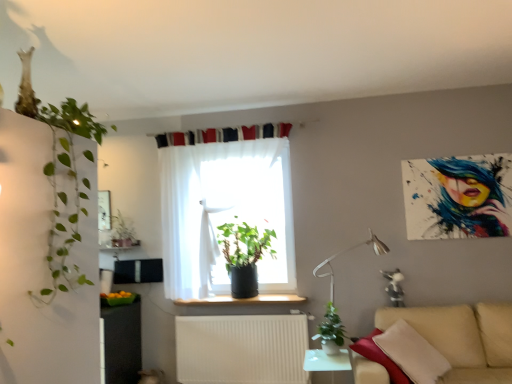
What do you see at coordinates (241, 349) in the screenshot?
I see `white matte radiator at lower center` at bounding box center [241, 349].

What are the coordinates of `green matte plant at upper left, which is the fourth houseplant in right-to-left order` in the screenshot? It's located at (122, 233).

What is the approximate height of green matte plant at lower center, which is the third houseplant in back-to-front order?

It is 14.74 inches.

Identify the location of green matte plant at lower center, which appears as the 2th houseplant when viewed from the front. This screenshot has width=512, height=384. (331, 331).

Where is `green leafy plant at left, which is counted as the 2th houseplant, starting from the left`? green leafy plant at left, which is counted as the 2th houseplant, starting from the left is located at coordinates (57, 182).

Measure the distance between beige fabric couch at lower right and camera.

beige fabric couch at lower right is 3.04 meters from camera.

This screenshot has height=384, width=512. I want to click on white matte radiator at lower center, so click(x=241, y=349).

Consider the image. How far apart are green leafy plant at left, acting as the third houseplant starting from the right, and white glossy table at lower center?

They are 7.13 feet apart.

From their relative heights in the image, would you say green leafy plant at left, acting as the third houseplant starting from the right, is taller or shorter than white glossy table at lower center?

In the image, green leafy plant at left, acting as the third houseplant starting from the right, appears to be taller than white glossy table at lower center.

From the image's perspective, between green leafy plant at left, the 4th houseplant viewed from the back, and white glossy table at lower center, which one is located above?

green leafy plant at left, the 4th houseplant viewed from the back.

In order to click on the 2nd houseplant to the left of the white glossy table at lower center, starting your count from the anchor in this screenshot , I will do `click(57, 182)`.

Is green matte plant at lower center, the 4th houseplant positioned from the left, in front of or behind white matte radiator at lower center in the image?

Clearly, green matte plant at lower center, the 4th houseplant positioned from the left, is in front of white matte radiator at lower center.

From a real-world perspective, is green matte plant at lower center, the 1th houseplant in the right-to-left sequence, positioned under white matte radiator at lower center based on gravity?

Incorrect, from a real-world perspective, green matte plant at lower center, the 1th houseplant in the right-to-left sequence, is higher than white matte radiator at lower center.

Is point (313, 338) less distant than point (298, 342)?

Yes.

Considering the relative sizes of green matte plant at lower center, which is the third houseplant in back-to-front order, and white matte radiator at lower center in the image provided, is green matte plant at lower center, which is the third houseplant in back-to-front order, smaller than white matte radiator at lower center?

Yes, green matte plant at lower center, which is the third houseplant in back-to-front order, is smaller than white matte radiator at lower center.

Who is bigger, green matte plant at upper left, which appears as the fourth houseplant when viewed from the front, or metallic silver table lamp at lower right?

metallic silver table lamp at lower right.

Are green matte plant at upper left, which appears as the fourth houseplant when viewed from the front, and metallic silver table lamp at lower right far apart?

Yes, green matte plant at upper left, which appears as the fourth houseplant when viewed from the front, and metallic silver table lamp at lower right are quite far apart.

From a real-world perspective, is green matte plant at upper left, which is the fourth houseplant in right-to-left order, positioned above or below metallic silver table lamp at lower right?

green matte plant at upper left, which is the fourth houseplant in right-to-left order, is situated higher than metallic silver table lamp at lower right in the real world.

Can you confirm if white matte radiator at lower center is wider than green matte plant at lower center, the 1th houseplant in the right-to-left sequence?

No.

Considering the relative positions of white matte radiator at lower center and green matte plant at lower center, which is the third houseplant in back-to-front order, in the image provided, is white matte radiator at lower center in front of green matte plant at lower center, which is the third houseplant in back-to-front order,?

No, white matte radiator at lower center is further to the viewer.

Visually, is white matte radiator at lower center positioned to the left or to the right of green matte plant at lower center, which is the third houseplant in back-to-front order?

white matte radiator at lower center is to the left of green matte plant at lower center, which is the third houseplant in back-to-front order.

Measure the distance between white matte radiator at lower center and green matte plant at lower center, which is the third houseplant in back-to-front order.

white matte radiator at lower center is 30.46 inches from green matte plant at lower center, which is the third houseplant in back-to-front order.

In terms of width, does green matte plant at lower center, the 1th houseplant in the right-to-left sequence, look wider or thinner when compared to black plastic window sill at center?

In the image, green matte plant at lower center, the 1th houseplant in the right-to-left sequence, appears to be more narrow than black plastic window sill at center.

From the image's perspective, is green matte plant at lower center, which is the third houseplant in back-to-front order, positioned above or below black plastic window sill at center?

Based on their image positions, green matte plant at lower center, which is the third houseplant in back-to-front order, is located beneath black plastic window sill at center.

From a real-world perspective, is green matte plant at lower center, the 4th houseplant positioned from the left, physically located above or below black plastic window sill at center?

In terms of real-world spatial position, green matte plant at lower center, the 4th houseplant positioned from the left, is below black plastic window sill at center.

Considering the relative sizes of green matte plant at center, arranged as the 3th houseplant when viewed from the front, and white glossy table at lower center in the image provided, is green matte plant at center, arranged as the 3th houseplant when viewed from the front, shorter than white glossy table at lower center?

Incorrect, the height of green matte plant at center, arranged as the 3th houseplant when viewed from the front, does not fall short of that of white glossy table at lower center.

Is green matte plant at center, which ranks as the 3th houseplant in left-to-right order, far from white glossy table at lower center?

Yes, green matte plant at center, which ranks as the 3th houseplant in left-to-right order, and white glossy table at lower center are located far from each other.

Is green matte plant at center, placed as the second houseplant when sorted from back to front, at the left side of white glossy table at lower center?

Yes.

Does green matte plant at center, which ranks as the 3th houseplant in left-to-right order, have a smaller size compared to white glossy table at lower center?

No, green matte plant at center, which ranks as the 3th houseplant in left-to-right order, is not smaller than white glossy table at lower center.

Is metallic silver table lamp at lower right oriented towards green matte plant at center, which ranks as the 3th houseplant in left-to-right order?

No, metallic silver table lamp at lower right is not facing towards green matte plant at center, which ranks as the 3th houseplant in left-to-right order.

In the scene shown: How many degrees apart are the facing directions of metallic silver table lamp at lower right and green matte plant at center, which ranks as the 3th houseplant in left-to-right order?

0.989 degrees.

Considering the relative sizes of metallic silver table lamp at lower right and green matte plant at center, arranged as the 3th houseplant when viewed from the front, in the image provided, is metallic silver table lamp at lower right bigger than green matte plant at center, arranged as the 3th houseplant when viewed from the front,?

Correct, metallic silver table lamp at lower right is larger in size than green matte plant at center, arranged as the 3th houseplant when viewed from the front.

Between metallic silver table lamp at lower right and green matte plant at center, acting as the 2th houseplant starting from the right, which one has less height?

Result: green matte plant at center, acting as the 2th houseplant starting from the right.

Identify the location of table on the right of green leafy plant at left, acting as the third houseplant starting from the right. (327, 362).

I want to click on radiator beneath the green matte plant at lower center, the 1th houseplant in the right-to-left sequence (from a real-world perspective), so click(241, 349).

Estimate the real-world distances between objects in this image. Which object is closer to green matte plant at center, acting as the 2th houseplant starting from the right, white matte radiator at lower center or white glossy table at lower center?

Based on the image, white matte radiator at lower center appears to be nearer to green matte plant at center, acting as the 2th houseplant starting from the right.

When comparing their distances from black plastic window sill at center, does white matte radiator at lower center or green matte plant at center, arranged as the 3th houseplant when viewed from the front, seem further?

white matte radiator at lower center.

When comparing their distances from sheer white curtain at center, does green leafy plant at left, which is counted as the 2th houseplant, starting from the left, or metallic silver table lamp at lower right seem closer?

Among the two, metallic silver table lamp at lower right is located nearer to sheer white curtain at center.

Estimate the real-world distances between objects in this image. Which object is closer to white glossy table at lower center, green matte plant at center, which ranks as the 3th houseplant in left-to-right order, or green matte plant at upper left, marked as the first houseplant in a left-to-right arrangement?

green matte plant at center, which ranks as the 3th houseplant in left-to-right order, is closer to white glossy table at lower center.

Looking at the image, which one is located further to black plastic window sill at center, green matte plant at upper left, which appears as the fourth houseplant when viewed from the front, or green leafy plant at left, which is counted as the 2th houseplant, starting from the left?

green leafy plant at left, which is counted as the 2th houseplant, starting from the left.

Consider the image. Estimate the real-world distances between objects in this image. Which object is further from metallic silver table lamp at lower right, white glossy table at lower center or green matte plant at lower center, which is the third houseplant in back-to-front order?

Among the two, white glossy table at lower center is located further to metallic silver table lamp at lower right.

When comparing their distances from green matte plant at center, acting as the 2th houseplant starting from the right, does green leafy plant at left, which is the first houseplant in front-to-back order, or beige fabric couch at lower right seem further?

green leafy plant at left, which is the first houseplant in front-to-back order, is further to green matte plant at center, acting as the 2th houseplant starting from the right.

Considering their positions, is sheer white curtain at center positioned closer to green leafy plant at left, which is counted as the 2th houseplant, starting from the left, than white matte radiator at lower center?

→ sheer white curtain at center is positioned closer to the anchor green leafy plant at left, which is counted as the 2th houseplant, starting from the left.

What are the coordinates of `radiator between green leafy plant at left, acting as the third houseplant starting from the right, and black plastic window sill at center, along the z-axis` in the screenshot? It's located at (241, 349).

At what (x,y) coordinates should I click in order to perform the action: click on curtain situated between green matte plant at upper left, marked as the first houseplant in a left-to-right arrangement, and black plastic window sill at center from left to right. Please return your answer as a coordinate pair (x, y). Image resolution: width=512 pixels, height=384 pixels. Looking at the image, I should click on (225, 214).

The height and width of the screenshot is (384, 512). I want to click on houseplant between sheer white curtain at center and green matte plant at lower center, the 1th houseplant in the right-to-left sequence, so click(x=244, y=255).

I want to click on window sill between green matte plant at center, acting as the 2th houseplant starting from the right, and white matte radiator at lower center vertically, so click(x=243, y=300).